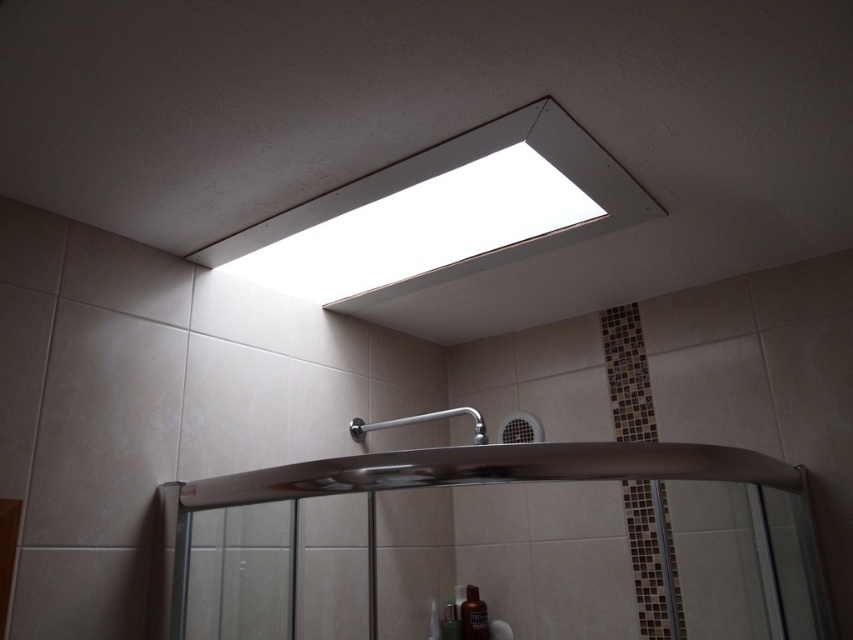
You are a painter standing 2 feet away from the shower enclosure. You want to paint the white fluorescent light at upper center. Can you reach it without moving closer than your current position?

The white fluorescent light at upper center is 3.40 feet away from the camera. Since you are already 2 feet away from the shower enclosure, you need to move closer to reach it.

Consider the image. You are a bathroom designer assessing the layout. You need to place a new decorative item between the satin nickel shower at center and the translucent plastic bottle at lower center. Considering their sizes, which object should the new item be placed closer to?

The new item should be placed closer to the translucent plastic bottle at lower center because the satin nickel shower at center is larger in size, so the bottle is smaller and the space between them would require the new item to be nearer to the smaller object to balance the layout.